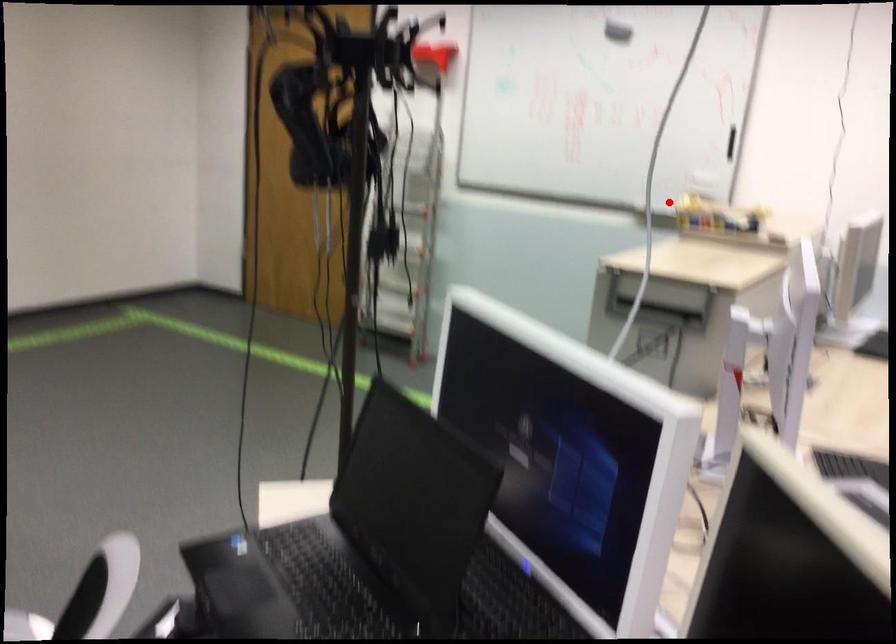
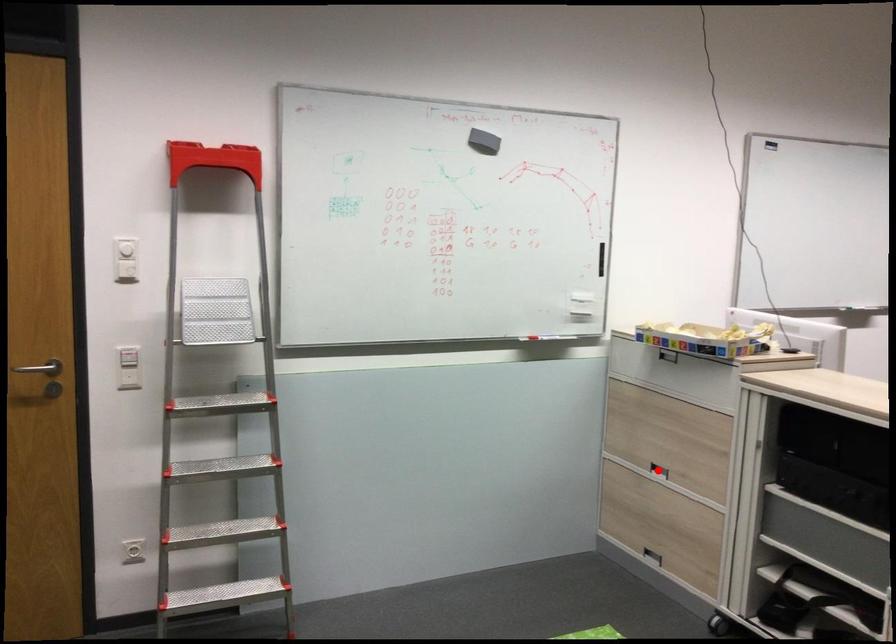
I am providing you with two images of the same scene from different viewpoints. A red point is marked on the first image and another point is marked on the second image. Do the highlighted points in image1 and image2 indicate the same real-world spot?

No